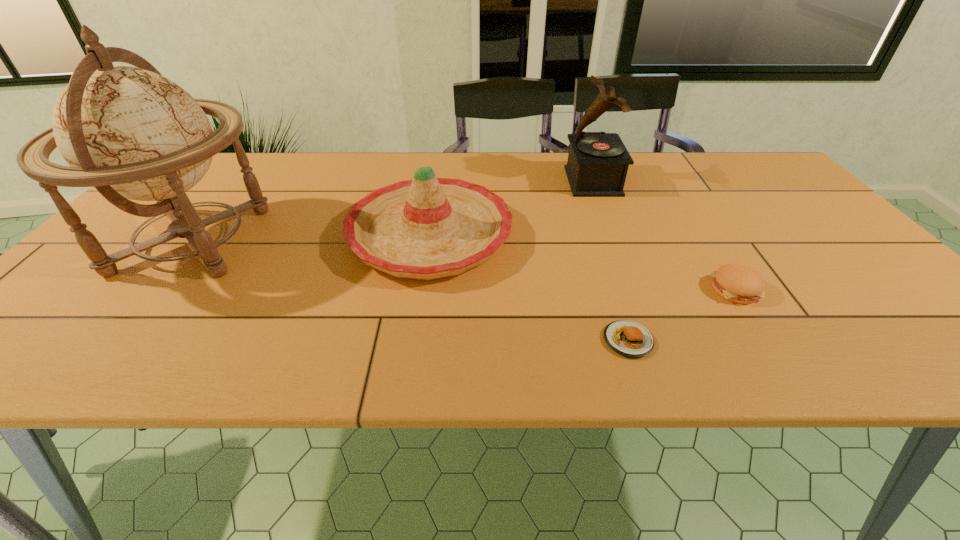
Where is `empty space between the sombrero and the phonograph_record`? This screenshot has width=960, height=540. empty space between the sombrero and the phonograph_record is located at coordinates click(x=512, y=208).

Identify which object is the second nearest to the leftmost object. Please provide its 2D coordinates. Your answer should be formatted as a tuple, i.e. [(x, y)], where the tuple contains the x and y coordinates of a point satisfying the conditions above.

[(627, 338)]

The image size is (960, 540). I want to click on the fourth closest object relative to the sombrero, so click(737, 283).

Locate an element on the screen. free space that satisfies the following two spatial constraints: 1. at the front of the tallest object showing Africa; 2. on the back side of the right food is located at coordinates (153, 289).

Identify the location of free spot that satisfies the following two spatial constraints: 1. at the front of the shorter food showing Africa; 2. on the right side of the leftmost object. The height and width of the screenshot is (540, 960). (110, 340).

Where is `blank area in the image that satisfies the following two spatial constraints: 1. at the horn opening of the fourth shortest object; 2. on the front side of the shorter food`? This screenshot has width=960, height=540. blank area in the image that satisfies the following two spatial constraints: 1. at the horn opening of the fourth shortest object; 2. on the front side of the shorter food is located at coordinates (655, 340).

The height and width of the screenshot is (540, 960). In order to click on free location that satisfies the following two spatial constraints: 1. at the horn opening of the farther food; 2. on the left side of the phonograph_record in this screenshot , I will do `click(636, 289)`.

At what (x,y) coordinates should I click in order to perform the action: click on vacant region that satisfies the following two spatial constraints: 1. at the horn opening of the right food; 2. on the right side of the phonograph_record. Please return your answer as a coordinate pair (x, y). The image size is (960, 540). Looking at the image, I should click on (636, 289).

Locate an element on the screen. vacant region that satisfies the following two spatial constraints: 1. at the horn opening of the phonograph_record; 2. on the back side of the rightmost object is located at coordinates (636, 289).

Identify the location of free space that satisfies the following two spatial constraints: 1. at the front of the fourth tallest object showing Africa; 2. on the left side of the globe. This screenshot has height=540, width=960. (153, 289).